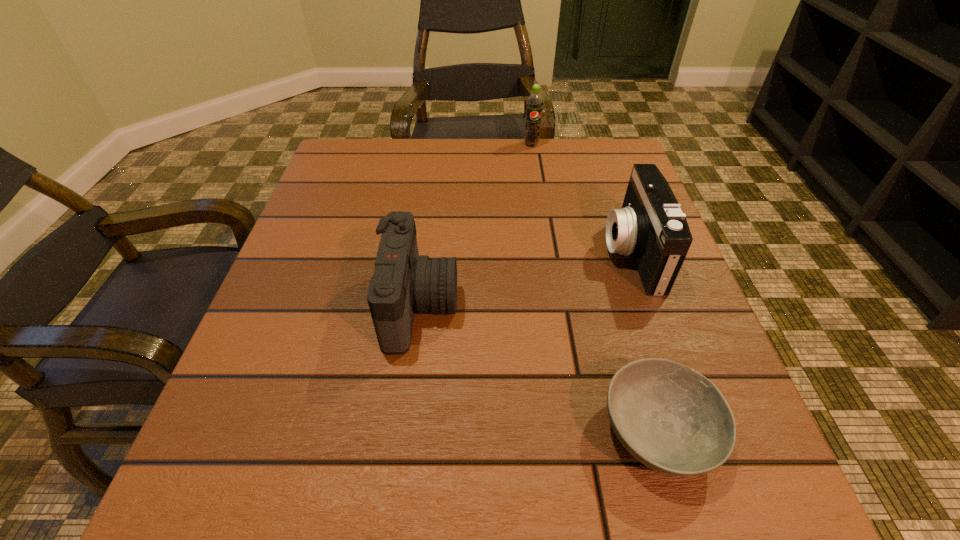
The height and width of the screenshot is (540, 960). What are the coordinates of `the farthest object` in the screenshot? It's located at (x=534, y=103).

Image resolution: width=960 pixels, height=540 pixels. In order to click on soda in this screenshot , I will do `click(534, 103)`.

In order to click on camcorder in this screenshot , I will do `click(650, 226)`.

Locate an element on the screen. camera is located at coordinates (403, 280).

This screenshot has height=540, width=960. Find the location of `the nearest object`. the nearest object is located at coordinates (672, 419).

Find the location of a particular element. The image size is (960, 540). bowl is located at coordinates (672, 419).

Locate an element on the screen. Image resolution: width=960 pixels, height=540 pixels. blank area located 0.080m on the front label of the farthest object is located at coordinates (535, 165).

Find the location of a particular element. This screenshot has height=540, width=960. vacant space located on the lens of the camcorder is located at coordinates (432, 253).

Locate an element on the screen. The width and height of the screenshot is (960, 540). vacant space located on the lens of the camcorder is located at coordinates (402, 253).

The width and height of the screenshot is (960, 540). I want to click on free space located on the lens of the camcorder, so click(x=438, y=253).